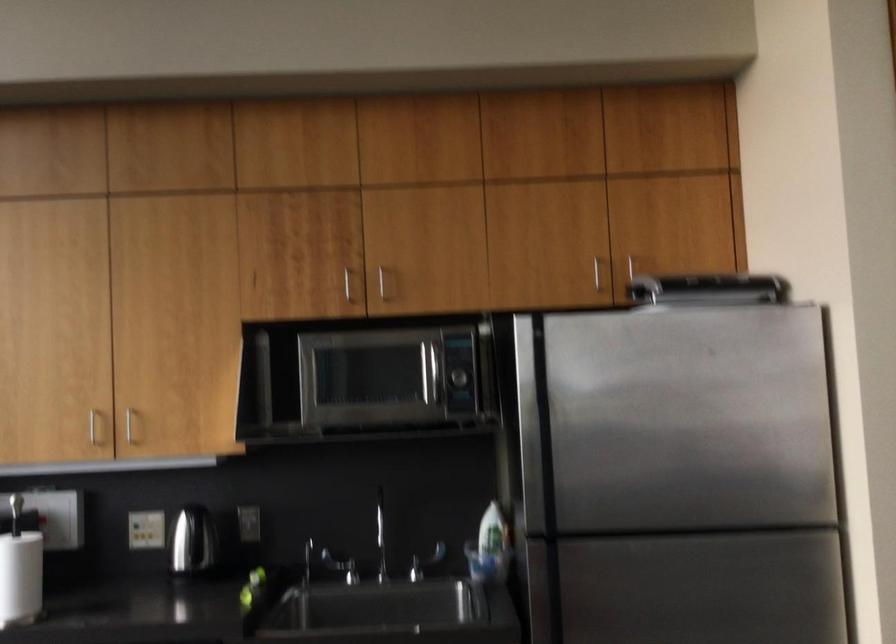
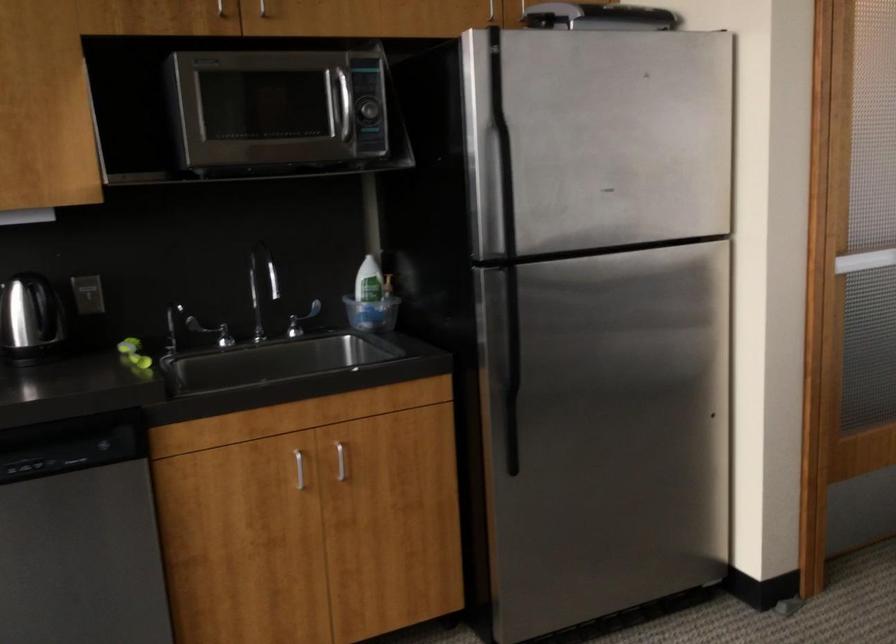
Question: How did the camera likely rotate?

Choices:
 (A) Left
 (B) Right
 (C) Up
 (D) Down

Answer: (B)